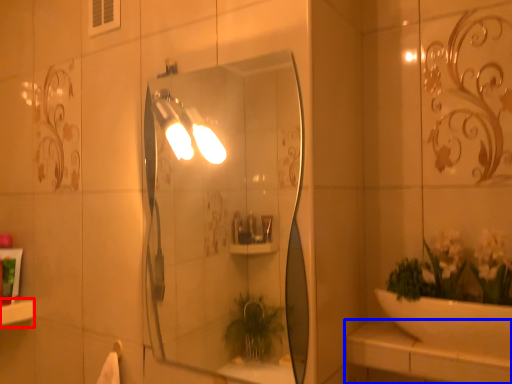
Question: Among these objects, which one is farthest to the camera, ledge (highlighted by a red box) or counter top (highlighted by a blue box)?

Choices:
 (A) ledge
 (B) counter top

Answer: (A)